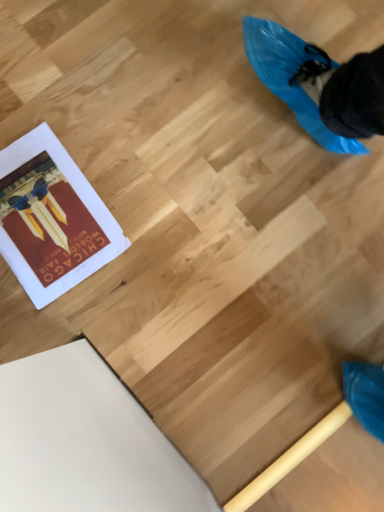
Where is `matte paper poster at lower left`? The width and height of the screenshot is (384, 512). matte paper poster at lower left is located at coordinates (52, 218).

What do you see at coordinates (52, 218) in the screenshot? I see `matte paper poster at lower left` at bounding box center [52, 218].

Find the location of a particular element. The image size is (384, 512). matte paper poster at lower left is located at coordinates (52, 218).